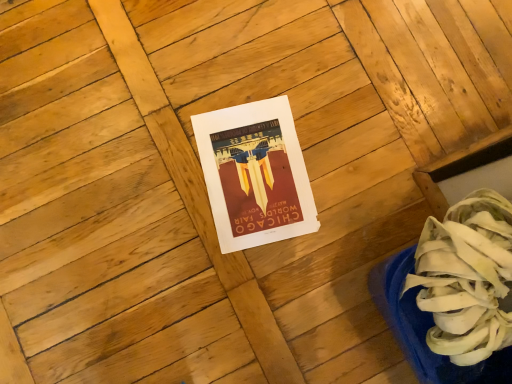
Identify the location of white fabric shoe at lower right. (467, 278).

This screenshot has height=384, width=512. Describe the element at coordinates (467, 278) in the screenshot. I see `white fabric shoe at lower right` at that location.

Image resolution: width=512 pixels, height=384 pixels. I want to click on white fabric shoe at lower right, so click(467, 278).